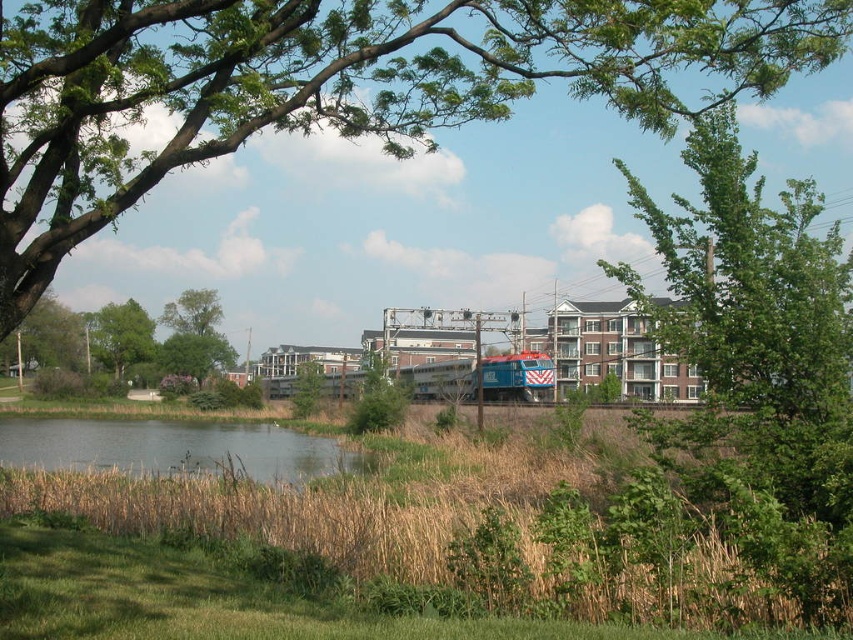
Question: Which point is closer to the camera?

Choices:
 (A) green grassy river at lower left
 (B) green leafy tree at center
 (C) green leafy tree at upper left

Answer: (C)

Question: Is green leafy tree at upper right positioned in front of green leafy tree at upper left?

Choices:
 (A) yes
 (B) no

Answer: (B)

Question: Considering the relative positions of green leafy tree at upper center and green leafy tree at left in the image provided, where is green leafy tree at upper center located with respect to green leafy tree at left?

Choices:
 (A) right
 (B) left

Answer: (A)

Question: Which object is the closest to the green leafy tree at upper center?

Choices:
 (A) green leafy tree at center
 (B) green leafy tree at upper left
 (C) green leafy tree at upper right

Answer: (C)

Question: Which of the following is the closest to the observer?

Choices:
 (A) green leafy tree at upper right
 (B) green leafy tree at upper center
 (C) green leafy tree at upper left

Answer: (B)

Question: Can you confirm if green leafy tree at upper center is positioned above green grassy river at lower left?

Choices:
 (A) yes
 (B) no

Answer: (A)